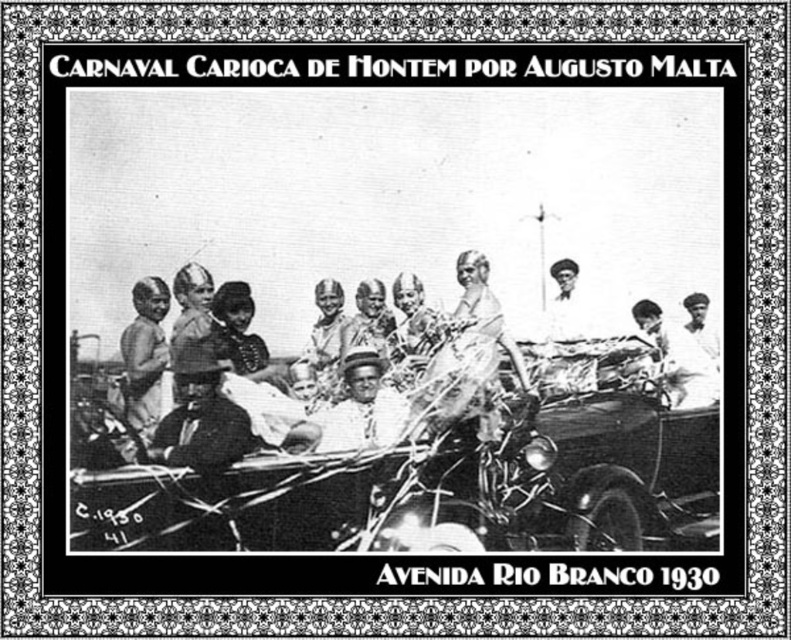
Question: Is shiny chrome car at center bigger than white cotton shirt at center?

Choices:
 (A) yes
 (B) no

Answer: (A)

Question: Which point is farther to the camera?

Choices:
 (A) light brown skin at left
 (B) smooth black suit at center
 (C) white cotton shirt at center

Answer: (A)

Question: Is shiny chrome car at center smaller than light brown skin at left?

Choices:
 (A) yes
 (B) no

Answer: (B)

Question: Can you confirm if smooth black suit at center is bigger than light brown skin at left?

Choices:
 (A) yes
 (B) no

Answer: (B)

Question: Which object is positioned closest to the white cotton shirt at center?

Choices:
 (A) smooth black suit at center
 (B) light brown skin at left
 (C) shiny chrome car at center

Answer: (A)

Question: Which object appears closest to the camera in this image?

Choices:
 (A) white cotton shirt at center
 (B) smooth black suit at center
 (C) shiny chrome car at center

Answer: (C)